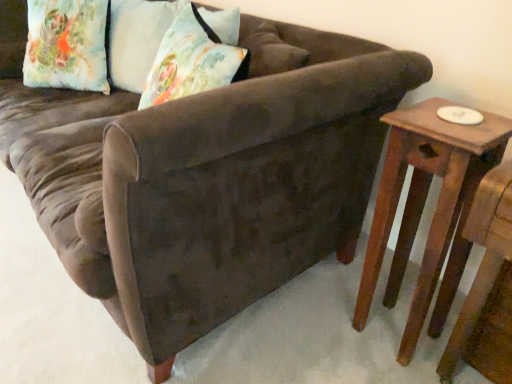
Question: Can you confirm if wooden side table at right is shorter than floral fabric pillow at upper left, which appears as the 2th pillow when viewed from the right?

Choices:
 (A) yes
 (B) no

Answer: (B)

Question: Are wooden side table at right and floral fabric pillow at upper left, which appears as the 2th pillow when viewed from the right, far apart?

Choices:
 (A) no
 (B) yes

Answer: (B)

Question: Is floral fabric pillow at upper left, which ranks as the first pillow in left-to-right order, at the back of wooden side table at right?

Choices:
 (A) no
 (B) yes

Answer: (A)

Question: From a real-world perspective, is wooden side table at right beneath floral fabric pillow at upper left, which ranks as the first pillow in left-to-right order?

Choices:
 (A) no
 (B) yes

Answer: (B)

Question: Can you confirm if wooden side table at right is thinner than floral fabric pillow at upper left, which ranks as the first pillow in left-to-right order?

Choices:
 (A) no
 (B) yes

Answer: (A)

Question: From a real-world perspective, is wooden side table at right physically located above or below floral fabric pillow at upper left, which is the 2th pillow in left-to-right order?

Choices:
 (A) above
 (B) below

Answer: (B)

Question: Would you say wooden side table at right is inside or outside floral fabric pillow at upper left, which is counted as the 1th pillow, starting from the right?

Choices:
 (A) inside
 (B) outside

Answer: (B)

Question: From their relative heights in the image, would you say wooden side table at right is taller or shorter than floral fabric pillow at upper left, which is counted as the 1th pillow, starting from the right?

Choices:
 (A) tall
 (B) short

Answer: (A)

Question: Is wooden side table at right bigger or smaller than floral fabric pillow at upper left, which is the 2th pillow in left-to-right order?

Choices:
 (A) small
 (B) big

Answer: (B)

Question: In terms of size, does floral fabric pillow at upper left, which appears as the 2th pillow when viewed from the right, appear bigger or smaller than floral fabric pillow at upper left, which is counted as the 1th pillow, starting from the right?

Choices:
 (A) small
 (B) big

Answer: (B)

Question: From their relative heights in the image, would you say floral fabric pillow at upper left, which appears as the 2th pillow when viewed from the right, is taller or shorter than floral fabric pillow at upper left, which is the 2th pillow in left-to-right order?

Choices:
 (A) short
 (B) tall

Answer: (B)

Question: From the image's perspective, is floral fabric pillow at upper left, which ranks as the first pillow in left-to-right order, located above or below floral fabric pillow at upper left, which is the 2th pillow in left-to-right order?

Choices:
 (A) below
 (B) above

Answer: (B)

Question: Considering the positions of point (88, 39) and point (223, 23), is point (88, 39) closer or farther from the camera than point (223, 23)?

Choices:
 (A) farther
 (B) closer

Answer: (A)

Question: Considering the positions of floral fabric pillow at upper left, which appears as the 2th pillow when viewed from the right, and wooden side table at right in the image, is floral fabric pillow at upper left, which appears as the 2th pillow when viewed from the right, taller or shorter than wooden side table at right?

Choices:
 (A) tall
 (B) short

Answer: (B)

Question: Is floral fabric pillow at upper left, which appears as the 2th pillow when viewed from the right, spatially inside wooden side table at right, or outside of it?

Choices:
 (A) outside
 (B) inside

Answer: (A)